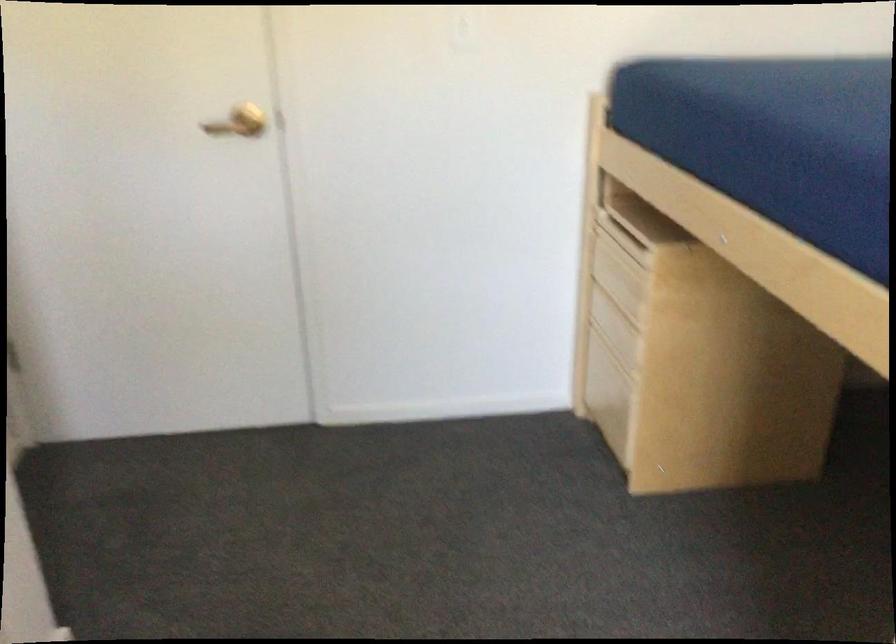
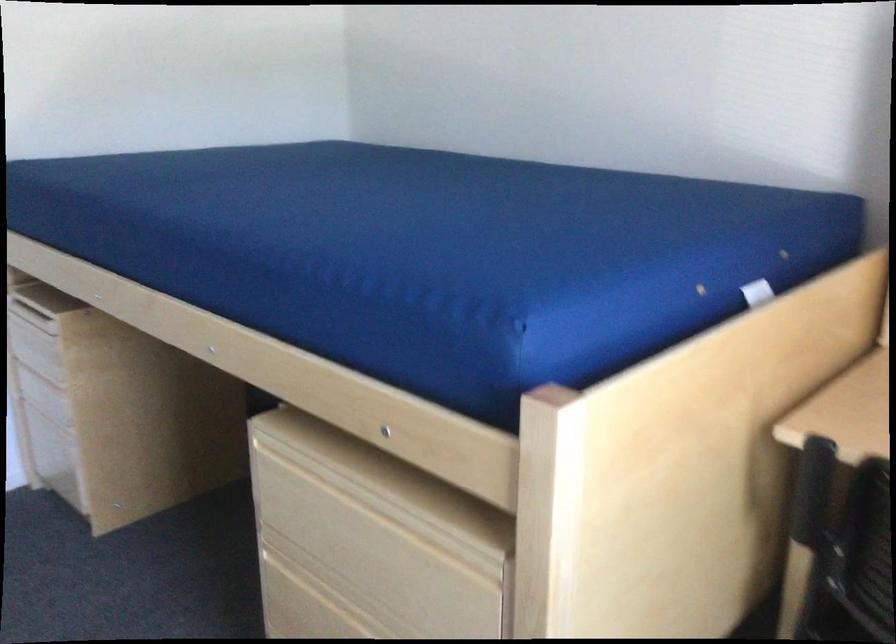
Find the pixel in the second image that matches pixel 581 310 in the first image.

(19, 395)